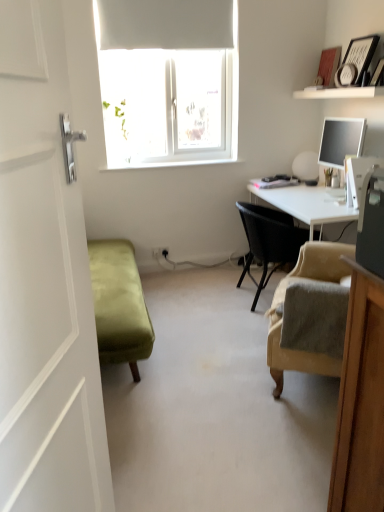
Question: Considering the relative sizes of beige fabric armchair at lower right, the second chair positioned from the back, and white matte shelf at upper right in the image provided, is beige fabric armchair at lower right, the second chair positioned from the back, bigger than white matte shelf at upper right?

Choices:
 (A) no
 (B) yes

Answer: (B)

Question: Does beige fabric armchair at lower right, the 1th chair viewed from the front, contain white matte shelf at upper right?

Choices:
 (A) yes
 (B) no

Answer: (B)

Question: Does beige fabric armchair at lower right, the 1th chair viewed from the front, come behind white matte shelf at upper right?

Choices:
 (A) no
 (B) yes

Answer: (A)

Question: Is beige fabric armchair at lower right, the 1th chair viewed from the front, looking in the opposite direction of white matte shelf at upper right?

Choices:
 (A) yes
 (B) no

Answer: (B)

Question: Is the surface of beige fabric armchair at lower right, the second chair positioned from the back, in direct contact with white matte shelf at upper right?

Choices:
 (A) yes
 (B) no

Answer: (B)

Question: Is beige fabric armchair at lower right, the second chair positioned from the back, at the right side of white matte shelf at upper right?

Choices:
 (A) no
 (B) yes

Answer: (A)

Question: Could you tell me if beige fabric armchair at lower right, the second chair positioned from the back, is turned towards white matte table lamp at right?

Choices:
 (A) no
 (B) yes

Answer: (A)

Question: Can you confirm if beige fabric armchair at lower right, the 1th chair viewed from the front, is smaller than white matte table lamp at right?

Choices:
 (A) no
 (B) yes

Answer: (A)

Question: Is beige fabric armchair at lower right, the 1th chair viewed from the front, at the left side of white matte table lamp at right?

Choices:
 (A) yes
 (B) no

Answer: (A)

Question: From a real-world perspective, is beige fabric armchair at lower right, the 1th chair viewed from the front, physically above white matte table lamp at right?

Choices:
 (A) no
 (B) yes

Answer: (A)

Question: Is the position of beige fabric armchair at lower right, the second chair positioned from the back, more distant than that of white matte table lamp at right?

Choices:
 (A) no
 (B) yes

Answer: (A)

Question: Does beige fabric armchair at lower right, the second chair positioned from the back, have a larger size compared to white matte table lamp at right?

Choices:
 (A) no
 (B) yes

Answer: (B)

Question: Can you confirm if beige fabric armchair at lower right, the second chair positioned from the back, is taller than black woven chair at center, acting as the first chair starting from the back?

Choices:
 (A) no
 (B) yes

Answer: (A)